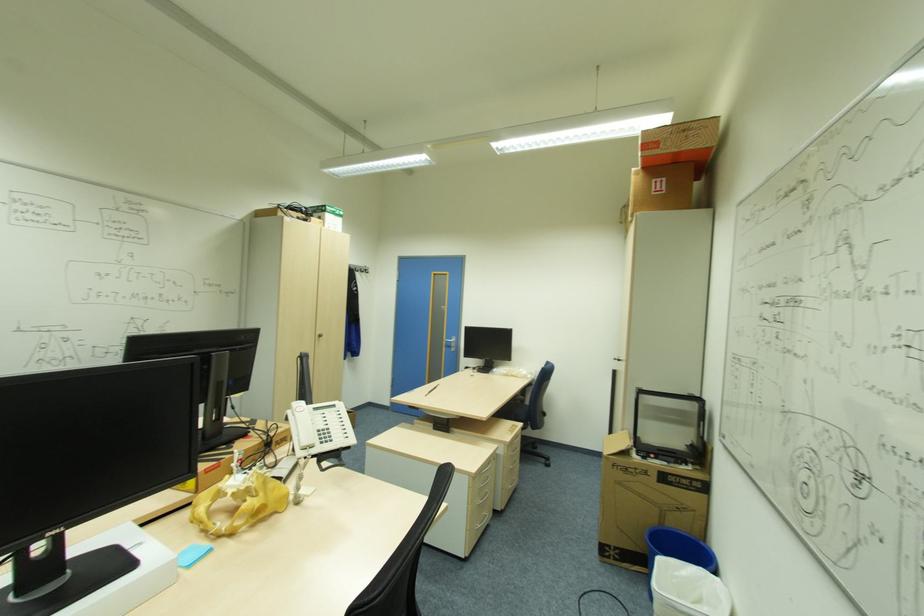
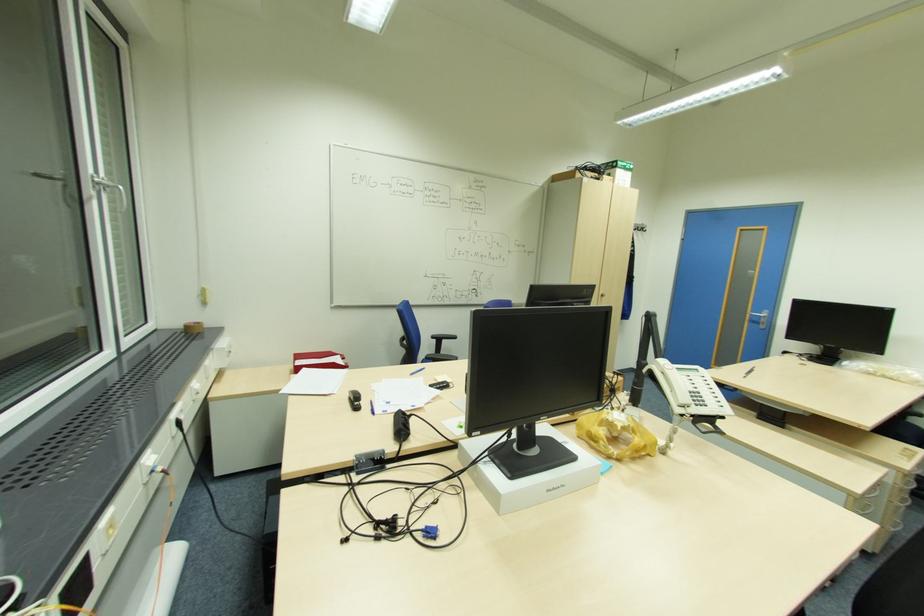
Find the pixel in the second image that matches pixel 476 477 in the first image.

(857, 498)